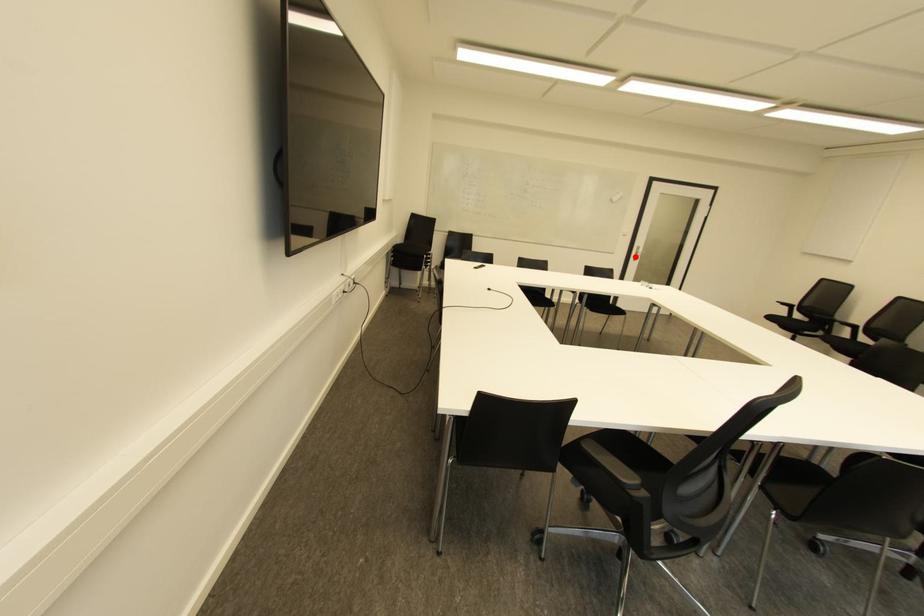
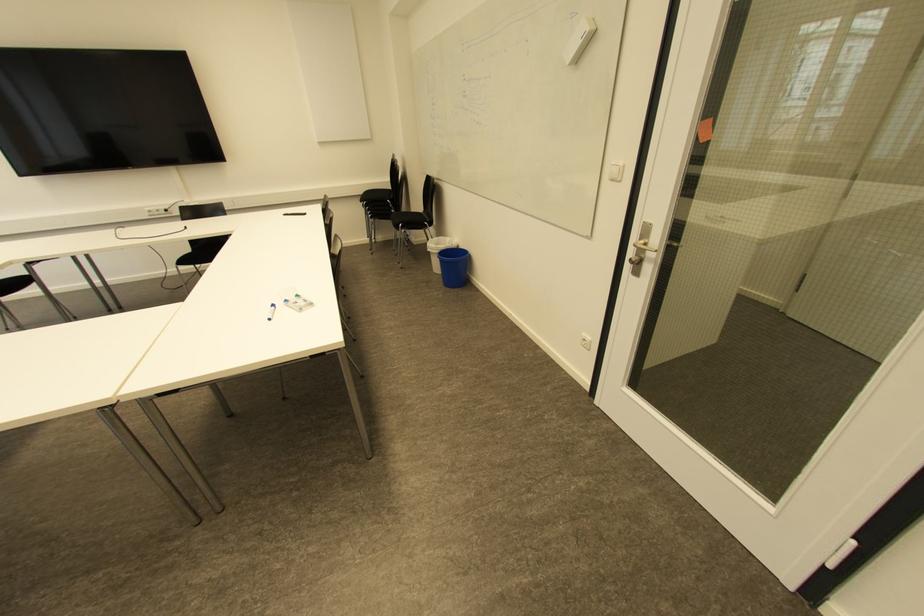
In the second image, find the point that corresponds to the highlighted location in the first image.

(638, 262)